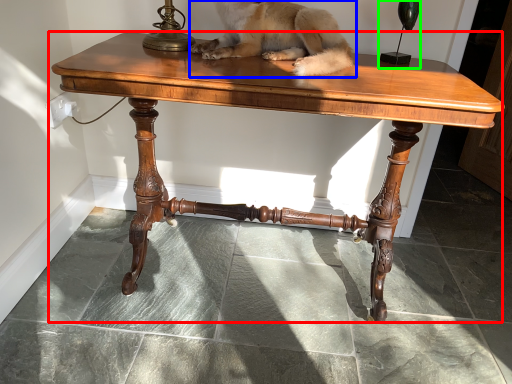
Question: Which object is positioned closest to table (highlighted by a red box)? Select from dog (highlighted by a blue box) and candle holder (highlighted by a green box).

Choices:
 (A) dog
 (B) candle holder

Answer: (A)